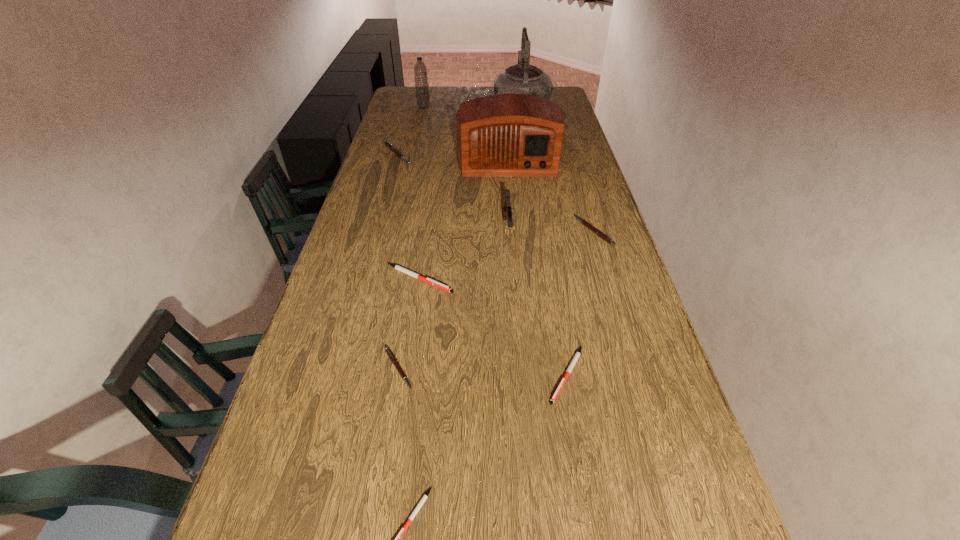
Locate an element on the screen. radio receiver present at the right edge is located at coordinates (509, 134).

Identify the location of pen at the right edge. The image size is (960, 540). (585, 223).

The width and height of the screenshot is (960, 540). Identify the location of object that is positioned at the far left corner. (420, 70).

Locate an element on the screen. object that is positioned at the far right corner is located at coordinates (522, 78).

The image size is (960, 540). Identify the location of vacant region at the left edge of the desktop. (345, 357).

In the image, there is a desktop. Where is `free space at the right edge`? free space at the right edge is located at coordinates (644, 402).

Where is `vacant space that's between the radio receiver and the second biggest white pen`? This screenshot has height=540, width=960. vacant space that's between the radio receiver and the second biggest white pen is located at coordinates (538, 267).

I want to click on vacant space that is in between the gun and the farthest pen, so click(452, 188).

Find the location of a particular element. The image size is (960, 540). free spot between the fourth nearest pen and the second nearest white pen is located at coordinates (493, 327).

This screenshot has width=960, height=540. Find the location of `free area in between the fifth pen from left to right and the smallest pink pen`. free area in between the fifth pen from left to right and the smallest pink pen is located at coordinates (482, 372).